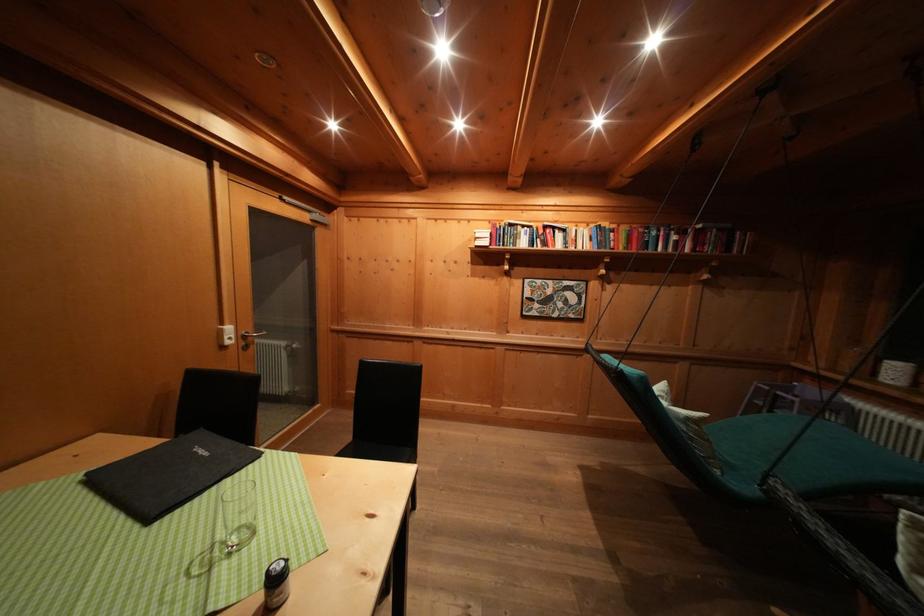
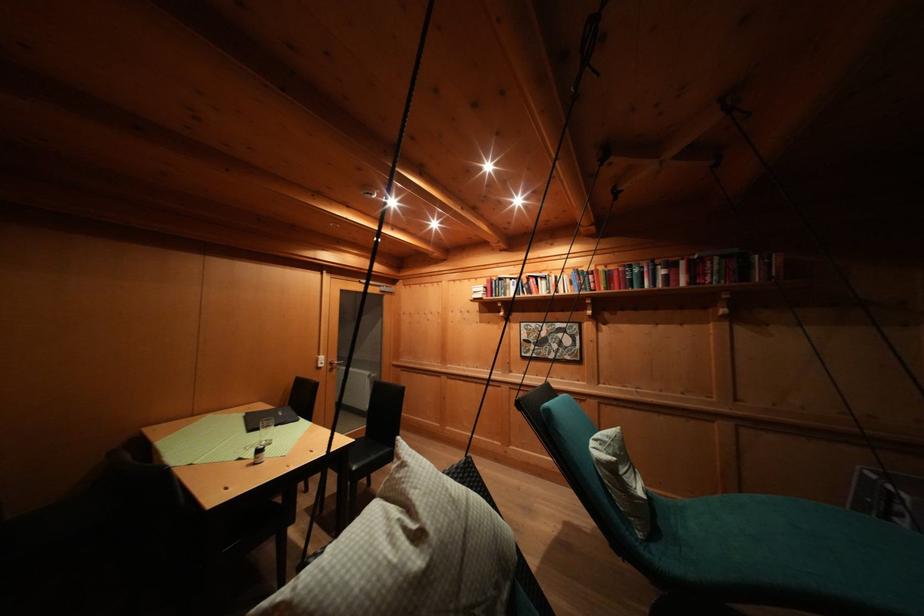
The point at (526, 233) is marked in the first image. Where is the corresponding point in the second image?

(514, 285)